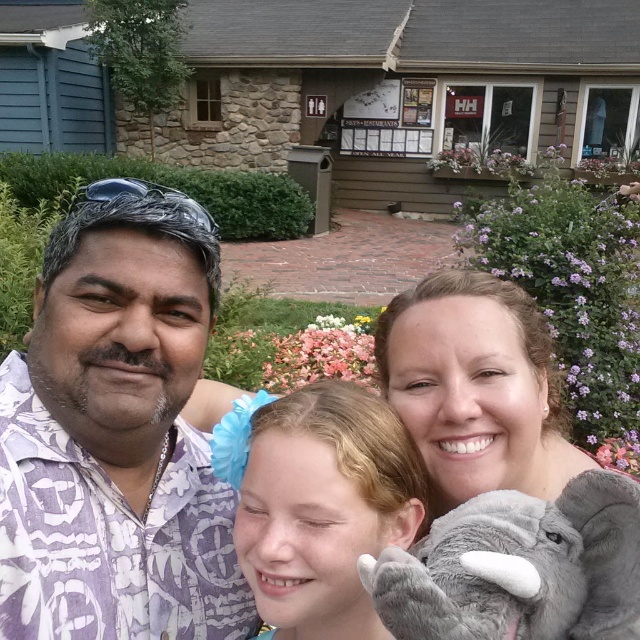
Question: Considering the relative positions of purple printed shirt at center and purple printed shirt at upper left in the image provided, where is purple printed shirt at center located with respect to purple printed shirt at upper left?

Choices:
 (A) right
 (B) left

Answer: (B)

Question: Which object appears closest to the camera in this image?

Choices:
 (A) purple printed shirt at upper left
 (B) gray plush elephant at lower center
 (C) matte gray plush at center

Answer: (B)

Question: Is light brown hair at center wider than matte gray plush at center?

Choices:
 (A) no
 (B) yes

Answer: (A)

Question: Does purple printed shirt at upper left appear under matte gray plush at center?

Choices:
 (A) no
 (B) yes

Answer: (B)

Question: Which point appears closest to the camera in this image?

Choices:
 (A) (387, 316)
 (B) (33, 404)

Answer: (B)

Question: Among these objects, which one is nearest to the camera?

Choices:
 (A) matte gray plush at center
 (B) gray plush elephant at lower center
 (C) purple printed shirt at center
 (D) purple printed shirt at upper left

Answer: (B)